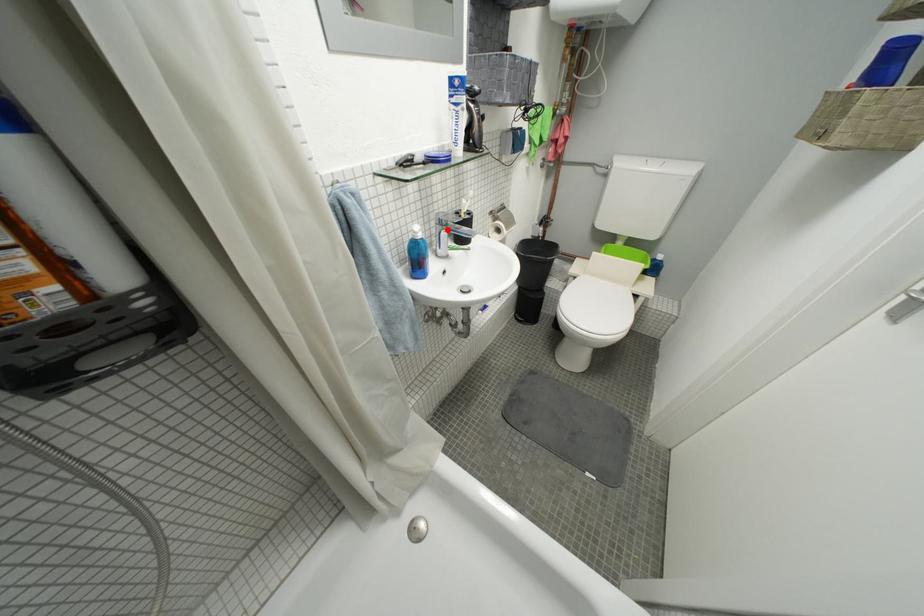
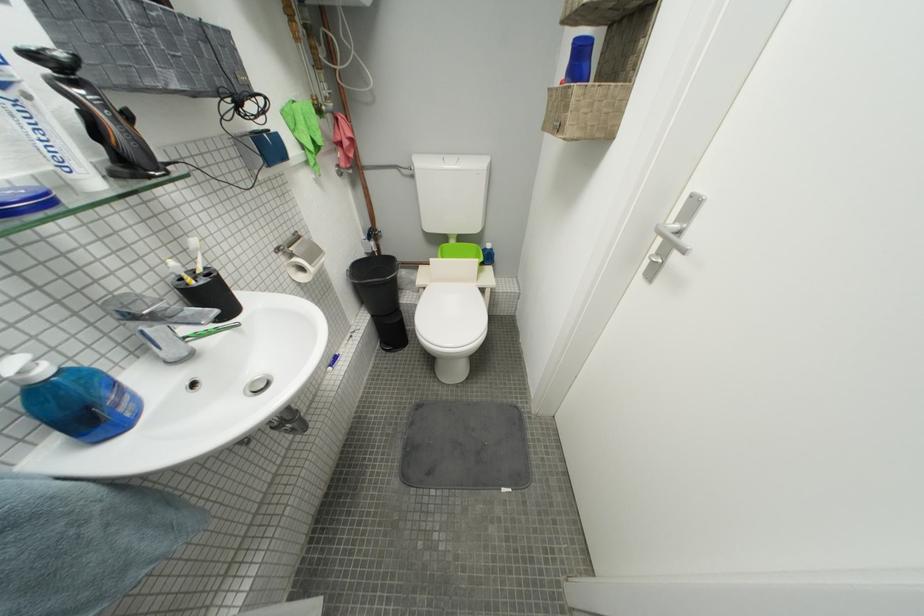
Question: I am providing you with two images of the same scene from different viewpoints. Image1 has a red point marked. In image2, the corresponding 3D location appears at what relative position? Reply with the corresponding letter.

Choices:
 (A) Closer
 (B) Farther

Answer: (B)